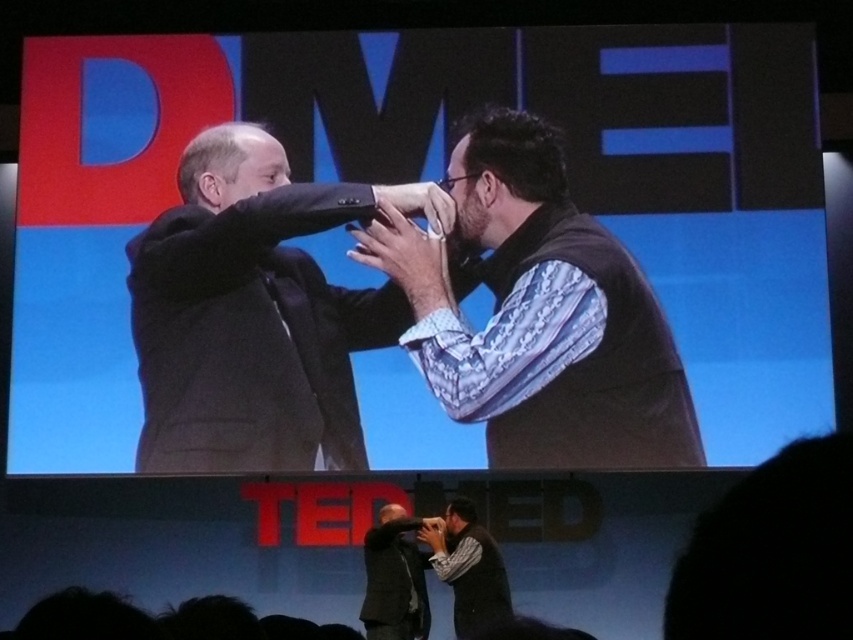
Does point (596, 268) come closer to viewer compared to point (398, 561)?

That is True.

Who is more forward, [525,440] or [364,628]?

Point [525,440] is in front.

The height and width of the screenshot is (640, 853). Find the location of `patterned shirt at center`. patterned shirt at center is located at coordinates (540, 316).

Can you confirm if matte black suit at upper center is wider than dark gray suit at center?

Correct, the width of matte black suit at upper center exceeds that of dark gray suit at center.

Between matte black suit at upper center and dark gray suit at center, which one has less height?

With less height is dark gray suit at center.

The image size is (853, 640). Find the location of `matte black suit at upper center`. matte black suit at upper center is located at coordinates (434, 177).

Is point (688, 65) positioned after point (624, 353)?

That is True.

Is matte black suit at upper center wider than patterned shirt at center?

Indeed, matte black suit at upper center has a greater width compared to patterned shirt at center.

This screenshot has width=853, height=640. I want to click on matte black suit at upper center, so click(x=434, y=177).

In order to click on matte black suit at upper center in this screenshot , I will do [434, 177].